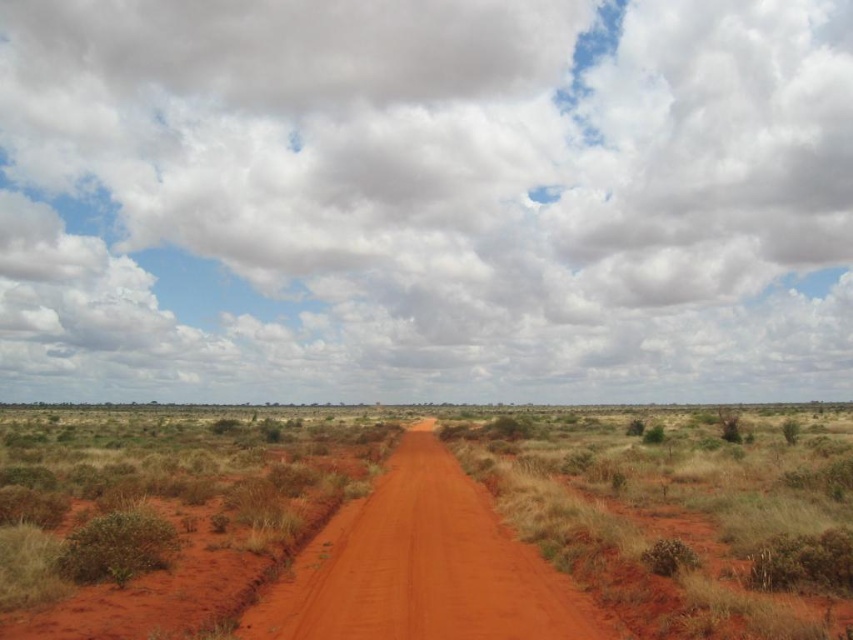
Question: Is cloudy sky at upper center further to camera compared to dusty red dirt track at center?

Choices:
 (A) yes
 (B) no

Answer: (A)

Question: Which point is farther to the camera?

Choices:
 (A) (10, 464)
 (B) (428, 468)
 (C) (94, 180)

Answer: (C)

Question: Considering the relative positions of dusty red dirt road at center and dusty red dirt track at center in the image provided, where is dusty red dirt road at center located with respect to dusty red dirt track at center?

Choices:
 (A) right
 (B) left

Answer: (B)

Question: Does cloudy sky at upper center appear on the right side of dusty red dirt track at center?

Choices:
 (A) no
 (B) yes

Answer: (A)

Question: Based on their relative distances, which object is nearer to the dusty red dirt road at center?

Choices:
 (A) cloudy sky at upper center
 (B) dusty red dirt track at center

Answer: (B)

Question: Which object appears closest to the camera in this image?

Choices:
 (A) dusty red dirt road at center
 (B) cloudy sky at upper center
 (C) dusty red dirt track at center

Answer: (A)